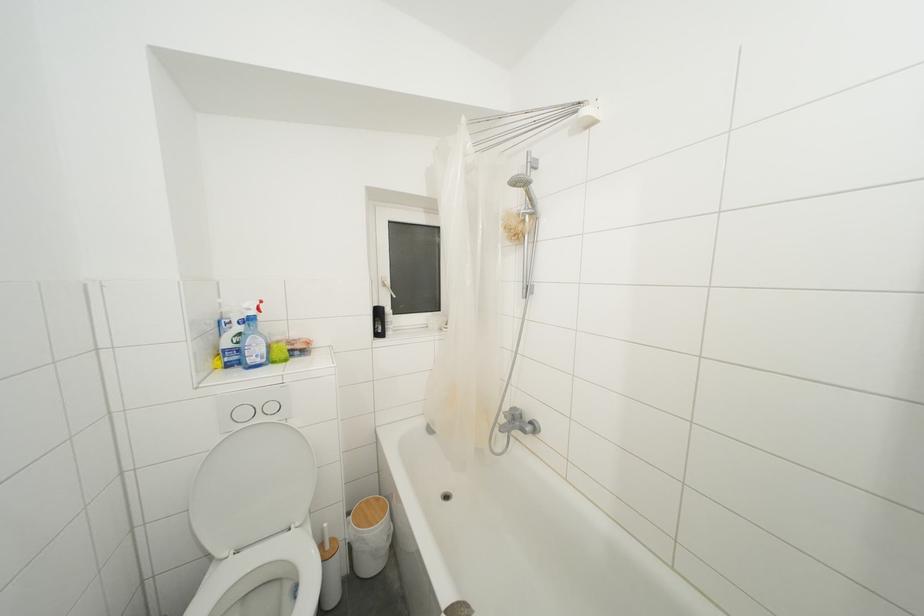
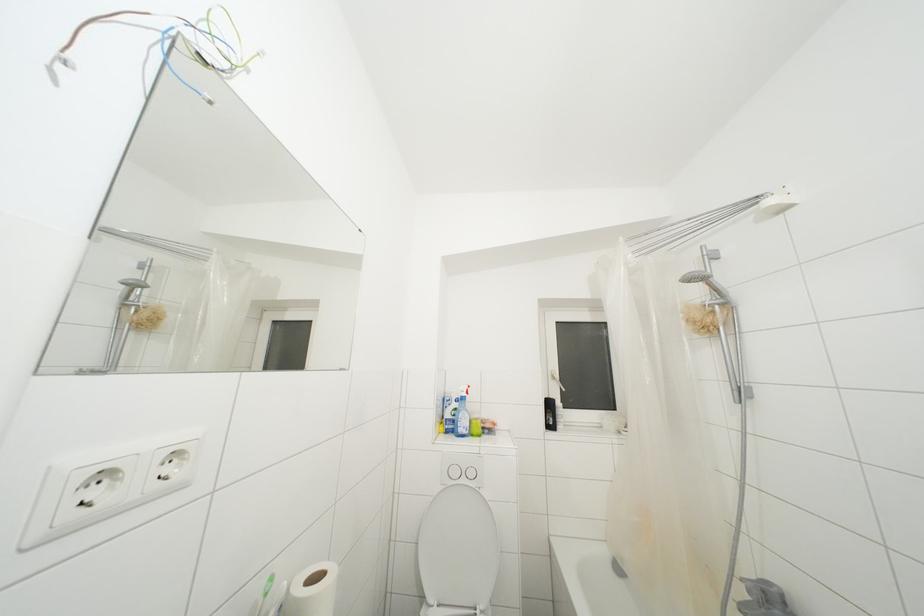
First-person continuous shooting, in which direction is the camera rotating?

The camera rotated toward left-up.